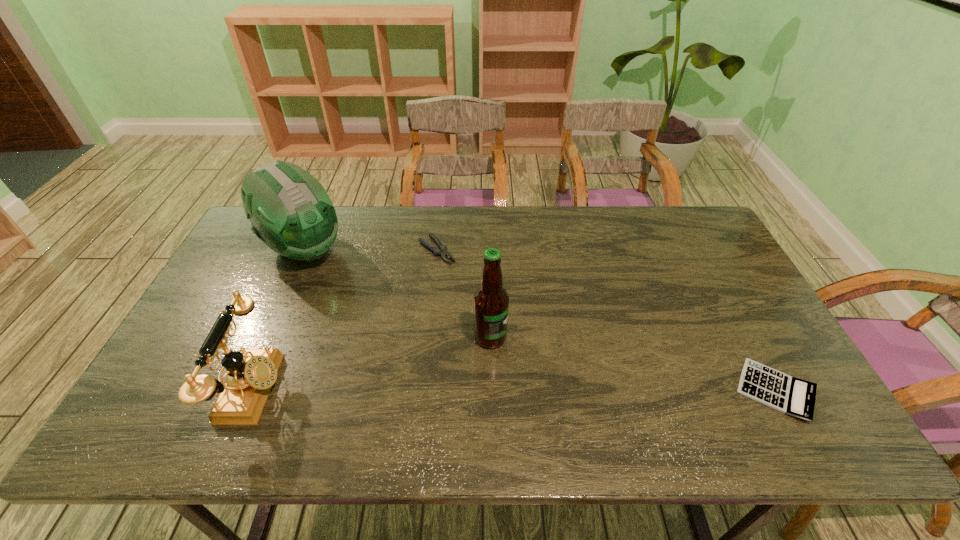
Where is `object that can be found as the third closest to the telephone`? object that can be found as the third closest to the telephone is located at coordinates (491, 301).